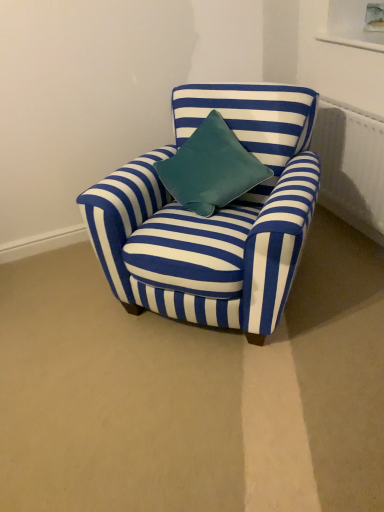
Find the location of `white textured radiator at upper right`. white textured radiator at upper right is located at coordinates (351, 165).

What do you see at coordinates (351, 165) in the screenshot?
I see `white textured radiator at upper right` at bounding box center [351, 165].

Find the location of `blue striped fabric chair at center`. blue striped fabric chair at center is located at coordinates (213, 216).

Looking at this image, measure the distance between point (237, 94) and camera.

Result: Point (237, 94) and camera are 1.92 meters apart.

The height and width of the screenshot is (512, 384). What do you see at coordinates (213, 216) in the screenshot? I see `blue striped fabric chair at center` at bounding box center [213, 216].

This screenshot has height=512, width=384. I want to click on white textured radiator at upper right, so click(351, 165).

Is blue striped fabric chair at center to the left of white textured radiator at upper right from the viewer's perspective?

Correct, you'll find blue striped fabric chair at center to the left of white textured radiator at upper right.

Considering the positions of objects blue striped fabric chair at center and white textured radiator at upper right in the image provided, who is in front, blue striped fabric chair at center or white textured radiator at upper right?

blue striped fabric chair at center is in front.

Which is closer, [235,266] or [343,209]?

Point [235,266] is positioned closer to the camera compared to point [343,209].

Looking at this image, from the image's perspective, would you say blue striped fabric chair at center is shown under white textured radiator at upper right?

Yes.

In the scene shown: From a real-world perspective, is blue striped fabric chair at center physically located above or below white textured radiator at upper right?

Clearly, from a real-world perspective, blue striped fabric chair at center is above white textured radiator at upper right.

Does blue striped fabric chair at center have a greater width compared to white textured radiator at upper right?

Indeed, blue striped fabric chair at center has a greater width compared to white textured radiator at upper right.

Considering the sizes of objects blue striped fabric chair at center and white textured radiator at upper right in the image provided, who is taller, blue striped fabric chair at center or white textured radiator at upper right?

Standing taller between the two is blue striped fabric chair at center.

Based on the photo, which of these two, blue striped fabric chair at center or white textured radiator at upper right, is bigger?

blue striped fabric chair at center.

Is white textured radiator at upper right a part of blue striped fabric chair at center?

No.

Is blue striped fabric chair at center far from white textured radiator at upper right?

No, blue striped fabric chair at center is in close proximity to white textured radiator at upper right.

Is blue striped fabric chair at center facing away from white textured radiator at upper right?

Correct, blue striped fabric chair at center is looking away from white textured radiator at upper right.

How many degrees apart are the facing directions of blue striped fabric chair at center and white textured radiator at upper right?

They differ by 42.2 degrees in their facing directions.

Locate an element on the screen. radiator that appears below the blue striped fabric chair at center (from a real-world perspective) is located at coordinates (351, 165).

In the image, is white textured radiator at upper right on the left side or the right side of blue striped fabric chair at center?

white textured radiator at upper right is positioned on blue striped fabric chair at center's right side.

Is white textured radiator at upper right behind blue striped fabric chair at center?

Yes, it is behind blue striped fabric chair at center.

Considering the points (366, 117) and (284, 152), which point is in front, point (366, 117) or point (284, 152)?

The point (284, 152) is in front.

From the image's perspective, is white textured radiator at upper right positioned above or below blue striped fabric chair at center?

Clearly, from the image's perspective, white textured radiator at upper right is above blue striped fabric chair at center.

From a real-world perspective, is white textured radiator at upper right on top of blue striped fabric chair at center?

No, from a real-world perspective, white textured radiator at upper right is not on top of blue striped fabric chair at center.

Which of these two, white textured radiator at upper right or blue striped fabric chair at center, is wider?

Wider between the two is blue striped fabric chair at center.

Is white textured radiator at upper right taller or shorter than blue striped fabric chair at center?

Clearly, white textured radiator at upper right is shorter compared to blue striped fabric chair at center.

Which of these two, white textured radiator at upper right or blue striped fabric chair at center, is smaller?

Smaller between the two is white textured radiator at upper right.

Is white textured radiator at upper right located outside blue striped fabric chair at center?

Yes, white textured radiator at upper right is located beyond the bounds of blue striped fabric chair at center.

Is white textured radiator at upper right with blue striped fabric chair at center?

Result: white textured radiator at upper right is not next to blue striped fabric chair at center, and they're not touching.

Is white textured radiator at upper right positioned with its back to blue striped fabric chair at center?

That's not correct — white textured radiator at upper right is not looking away from blue striped fabric chair at center.

How far apart are white textured radiator at upper right and blue striped fabric chair at center?

They are 29.25 inches apart.

This screenshot has width=384, height=512. I want to click on chair that is above the white textured radiator at upper right (from a real-world perspective), so click(213, 216).

In the image, there is a white textured radiator at upper right. Find the location of `chair below it (from the image's perspective)`. chair below it (from the image's perspective) is located at coordinates (213, 216).

Image resolution: width=384 pixels, height=512 pixels. I want to click on chair that appears above the white textured radiator at upper right (from a real-world perspective), so click(213, 216).